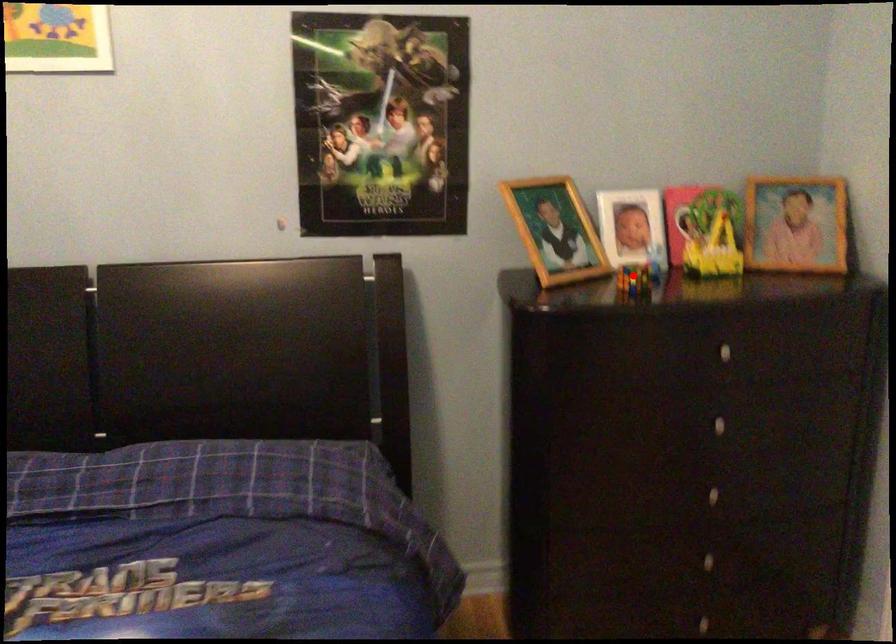
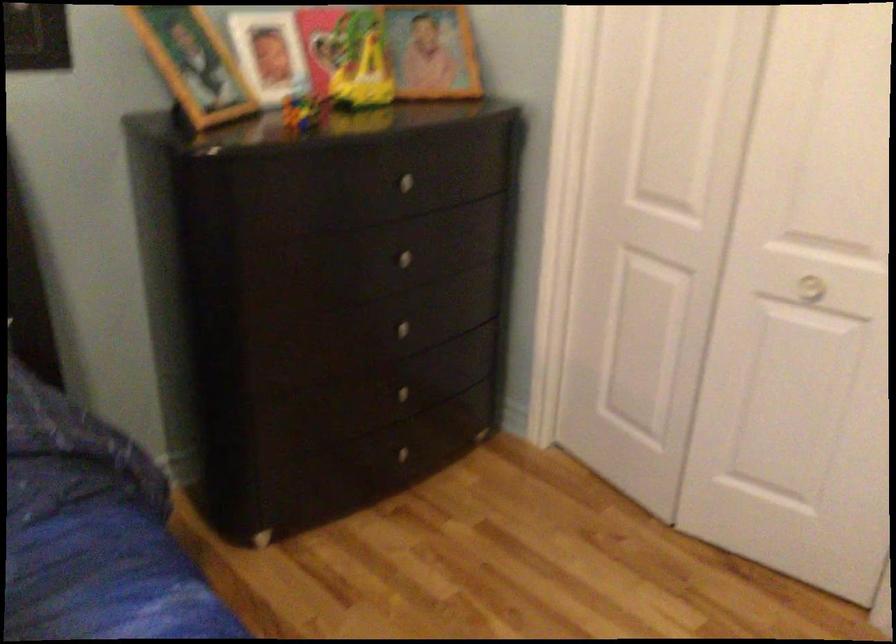
Locate, in the second image, the point that corresponds to the highlighted location in the first image.

(303, 111)